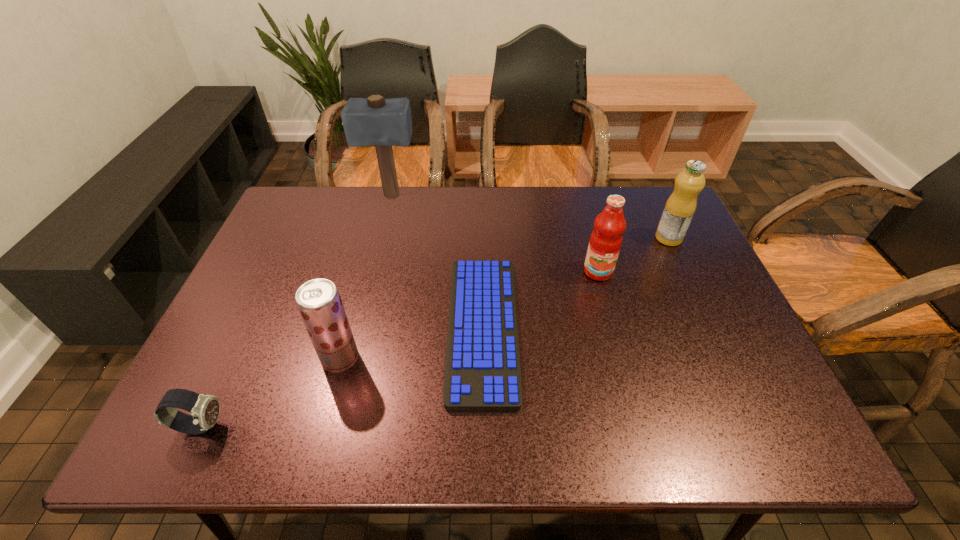
Identify the location of unoccupied position between the computer keyboard and the leftmost fruit juice. The width and height of the screenshot is (960, 540). (412, 343).

What are the coordinates of `free spot between the watch and the computer keyboard` in the screenshot? It's located at (342, 377).

The height and width of the screenshot is (540, 960). In order to click on unoccupied area between the rightmost object and the computer keyboard in this screenshot , I will do `click(576, 283)`.

You are a GUI agent. You are given a task and a screenshot of the screen. Output one action in this format:
    pyautogui.click(x=<x>, y=<y>)
    Task: Click on the object identified as the second closest to the second farthest object
    
    Given the screenshot: What is the action you would take?
    pyautogui.click(x=482, y=370)

Select which object is the third closest to the farthest object. Please provide its 2D coordinates. Your answer should be formatted as a tuple, i.e. [(x, y)], where the tuple contains the x and y coordinates of a point satisfying the conditions above.

[(605, 242)]

I want to click on fruit juice that stands as the third closest to the leftmost object, so click(x=680, y=207).

Locate which fruit juice ranks in proximity to the second shortest object. Please provide its 2D coordinates. Your answer should be formatted as a tuple, i.e. [(x, y)], where the tuple contains the x and y coordinates of a point satisfying the conditions above.

[(319, 303)]

Find the location of a particular element. free space that satisfies the following two spatial constraints: 1. on the front side of the computer keyboard; 2. on the face of the leftmost object is located at coordinates (483, 426).